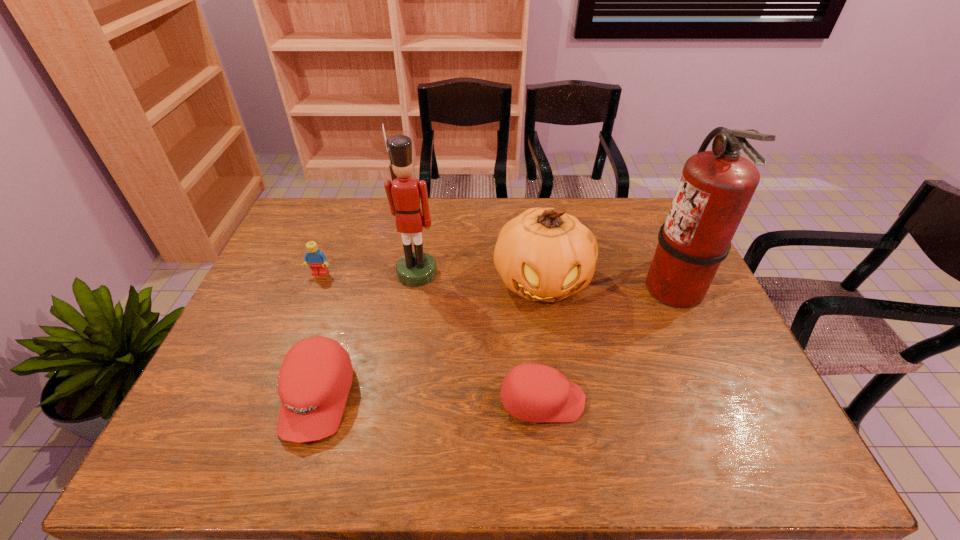
This screenshot has height=540, width=960. I want to click on free space for a new cap on the right, so click(769, 404).